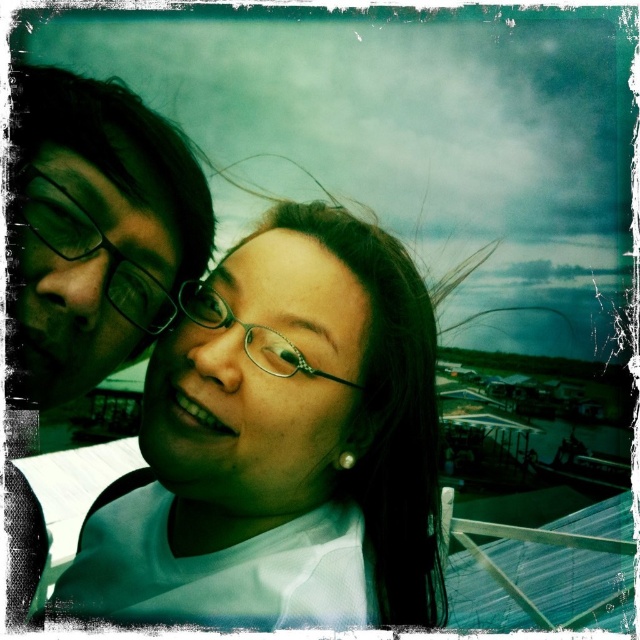
Is white matte/soft fabric at center smaller than pearl earrings at center?

Actually, white matte/soft fabric at center might be larger than pearl earrings at center.

How distant is white matte/soft fabric at center from pearl earrings at center?

A distance of 3.90 inches exists between white matte/soft fabric at center and pearl earrings at center.

Identify the location of white matte/soft fabric at center. Image resolution: width=640 pixels, height=640 pixels. (284, 426).

This screenshot has width=640, height=640. I want to click on white matte/soft fabric at center, so click(284, 426).

Who is higher up, pearl earrings at center or clear plastic glasses at center?

clear plastic glasses at center is higher up.

Can you confirm if pearl earrings at center is thinner than clear plastic glasses at center?

No.

Who is more distant from viewer, (227, 342) or (211, 307)?

The point (211, 307) is behind.

This screenshot has width=640, height=640. Find the location of `pearl earrings at center`. pearl earrings at center is located at coordinates (259, 376).

Consider the image. Which of these two, white matte/soft fabric at center or clear plastic glasses at center, stands taller?

Standing taller between the two is white matte/soft fabric at center.

Is white matte/soft fabric at center positioned in front of clear plastic glasses at center?

Yes, white matte/soft fabric at center is closer to the viewer.

Who is more distant from viewer, (326, 260) or (305, 365)?

The point (326, 260) is more distant.

Where is `white matte/soft fabric at center`? This screenshot has height=640, width=640. white matte/soft fabric at center is located at coordinates (284, 426).